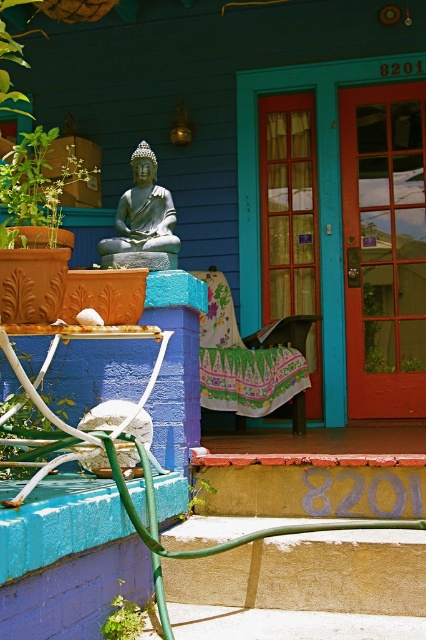
You are a delivery person trying to place a small package between the green leafy plant at left and the green leafy plant at lower left. The package is 5 feet long. Will it fit between them?

The distance between the green leafy plant at left and the green leafy plant at lower left is 4.85 feet. Since the package is 5 feet long, it will not fit between them.

You are a delivery person trying to place a package between the floral fabric rocking chair at center and the polished bronze statue at center. The package requires 6 feet of space. Can you fit it there?

The distance between the floral fabric rocking chair at center and the polished bronze statue at center is 6.19 feet, which is more than enough to fit the package requiring 6 feet of space.